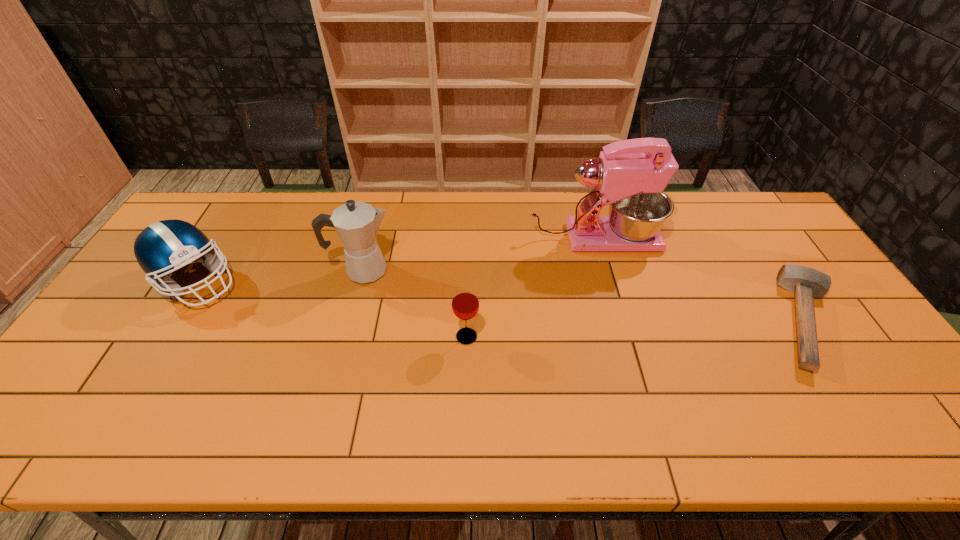
Point out which object is positioned as the second nearest to the football helmet. Please provide its 2D coordinates. Your answer should be formatted as a tuple, i.e. [(x, y)], where the tuple contains the x and y coordinates of a point satisfying the conditions above.

[(465, 304)]

Identify the location of object that is the fourth closest one to the leftmost object. Image resolution: width=960 pixels, height=540 pixels. (806, 283).

Where is `vacant space that satisfies the following two spatial constraints: 1. at the front of the rightmost object with the faceguard; 2. on the right side of the leftmost object`? The image size is (960, 540). vacant space that satisfies the following two spatial constraints: 1. at the front of the rightmost object with the faceguard; 2. on the right side of the leftmost object is located at coordinates (174, 321).

Where is `free space that satisfies the following two spatial constraints: 1. at the front of the leftmost object with the faceguard; 2. on the left side of the third object from left to right`? free space that satisfies the following two spatial constraints: 1. at the front of the leftmost object with the faceguard; 2. on the left side of the third object from left to right is located at coordinates pyautogui.click(x=164, y=336).

You are a GUI agent. You are given a task and a screenshot of the screen. Output one action in this format:
    pyautogui.click(x=<x>, y=<y>)
    Task: Click on the free location that satisfies the following two spatial constraints: 1. on the front side of the glass; 2. on the left side of the second object from left to right
    
    Given the screenshot: What is the action you would take?
    pyautogui.click(x=347, y=336)

Find the location of `vacant point that satisfies the following two spatial constraints: 1. at the front of the leftmost object with the faceguard; 2. on the back side of the rightmost object`. vacant point that satisfies the following two spatial constraints: 1. at the front of the leftmost object with the faceguard; 2. on the back side of the rightmost object is located at coordinates (174, 321).

Find the location of `free space that satisfies the following two spatial constraints: 1. at the front of the shortest object with the faceguard; 2. on the left side of the leftmost object`. free space that satisfies the following two spatial constraints: 1. at the front of the shortest object with the faceguard; 2. on the left side of the leftmost object is located at coordinates (174, 321).

The image size is (960, 540). I want to click on free space that satisfies the following two spatial constraints: 1. at the front of the leftmost object with the faceguard; 2. on the back side of the glass, so click(x=164, y=336).